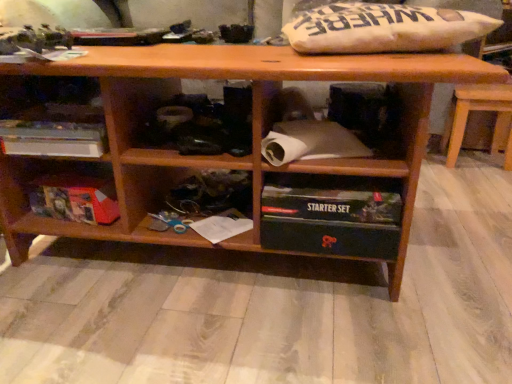
I want to click on vacant space situated above matte cardboard box at lower left, acting as the 3th shelf starting from the right (from a real-world perspective), so click(x=77, y=174).